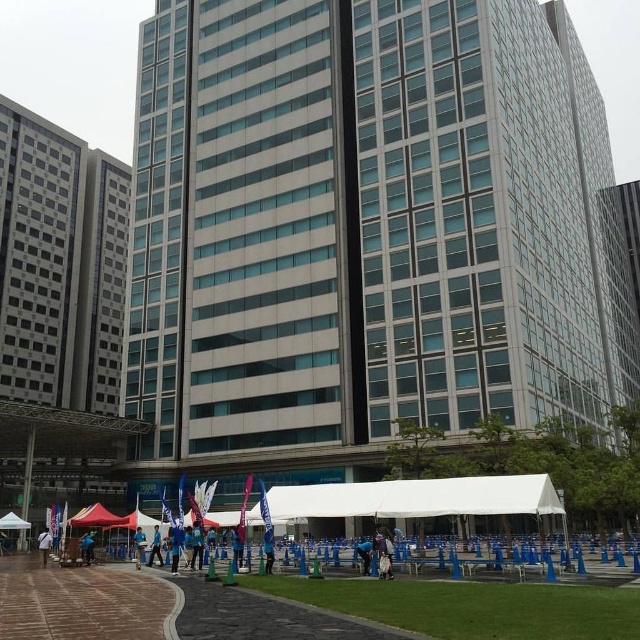
Question: Is white fabric canopy at center closer to camera compared to blue fabric flag at lower center?

Choices:
 (A) no
 (B) yes

Answer: (B)

Question: Does white fabric canopy at lower left have a lesser width compared to blue fabric tent at center?

Choices:
 (A) no
 (B) yes

Answer: (A)

Question: Which object appears farthest from the camera in this image?

Choices:
 (A) blue fabric at center
 (B) white fabric canopy at lower left
 (C) blue fabric flag at lower center
 (D) white fabric canopy at center

Answer: (B)

Question: Among these points, which one is farthest from the camera?

Choices:
 (A) (467, 492)
 (B) (1, 528)

Answer: (B)

Question: Which of these objects is positioned farthest from the blue fabric at center?

Choices:
 (A) white fabric bag at lower center
 (B) blue fabric person at center

Answer: (A)

Question: Does blue fabric at center lie behind blue fabric tent at center?

Choices:
 (A) no
 (B) yes

Answer: (A)